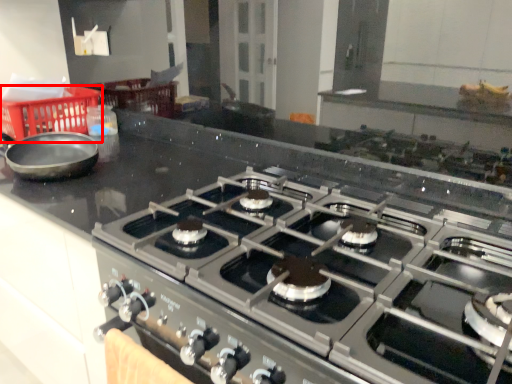
Question: From the image's perspective, where is basket (annotated by the red box) located relative to gas stove?

Choices:
 (A) below
 (B) above

Answer: (B)